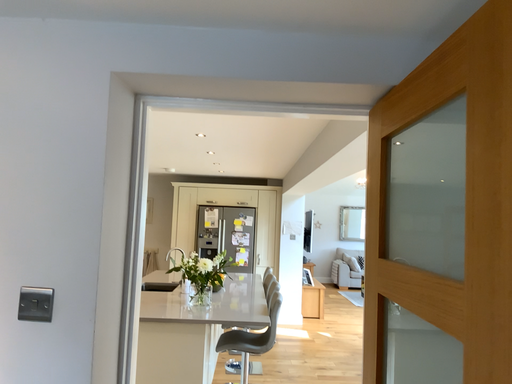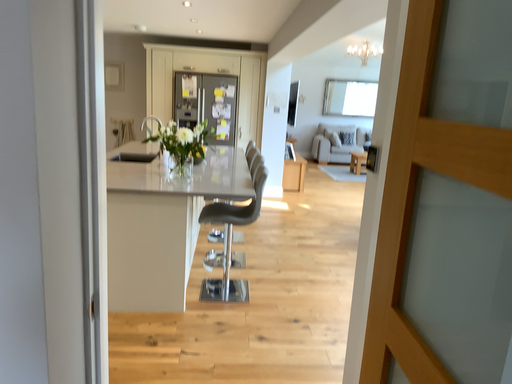
Question: How did the camera likely rotate when shooting the video?

Choices:
 (A) rotated downward
 (B) rotated upward

Answer: (A)